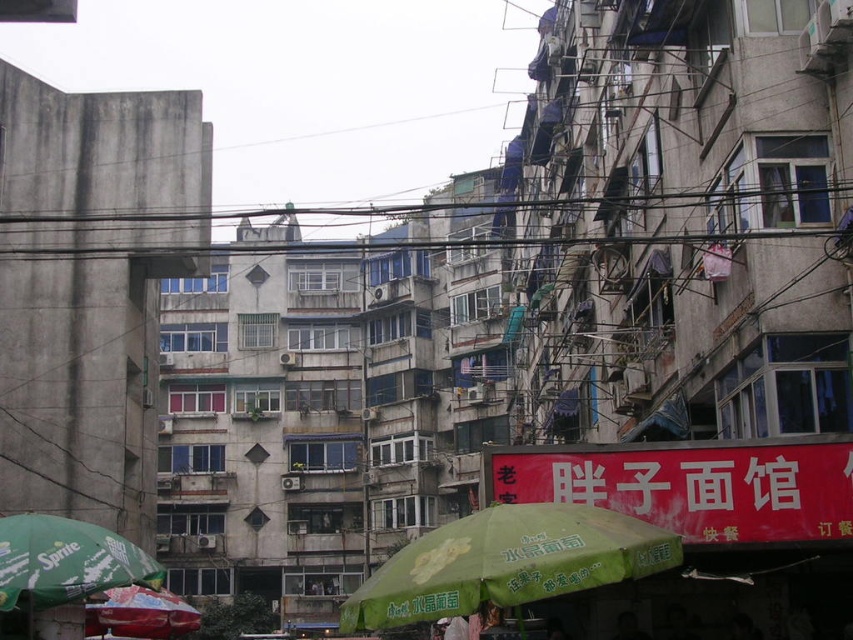
Question: Based on their relative distances, which object is nearer to the black wire at upper center?

Choices:
 (A) green fabric umbrella at lower left
 (B) red matte umbrella at lower left

Answer: (A)

Question: Is black wire at upper center thinner than red matte umbrella at lower left?

Choices:
 (A) no
 (B) yes

Answer: (A)

Question: Is green fabric umbrella at center to the left of black wire at upper center from the viewer's perspective?

Choices:
 (A) no
 (B) yes

Answer: (A)

Question: Which object is the farthest from the red matte umbrella at lower left?

Choices:
 (A) green fabric umbrella at center
 (B) black wire at upper center
 (C) green fabric umbrella at lower left

Answer: (B)

Question: Can you confirm if green fabric umbrella at center is bigger than green fabric umbrella at lower left?

Choices:
 (A) yes
 (B) no

Answer: (B)

Question: Which point is closer to the camera taking this photo?

Choices:
 (A) (585, 554)
 (B) (91, 545)
 (C) (93, 627)

Answer: (A)